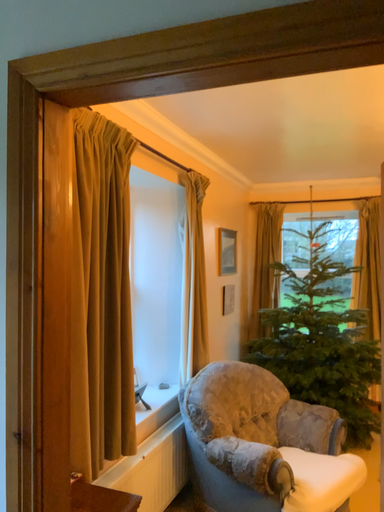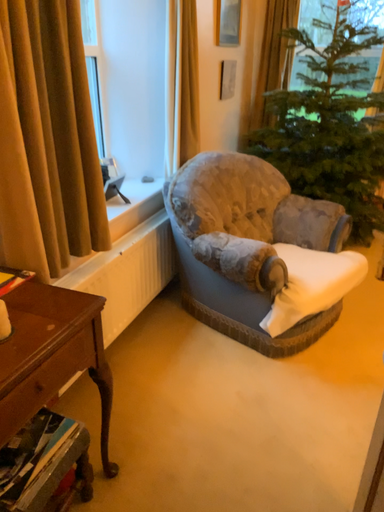
Question: Which way did the camera rotate in the video?

Choices:
 (A) rotated upward
 (B) rotated downward

Answer: (B)